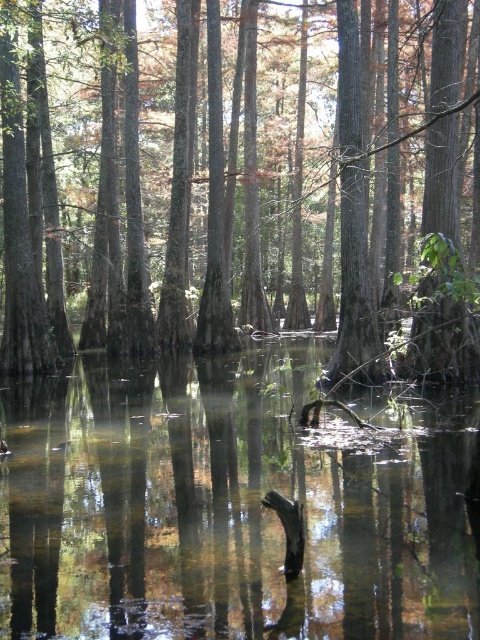
Question: Which object is farther from the camera taking this photo?

Choices:
 (A) transparent water at center
 (B) smooth brown tree trunk at center

Answer: (B)

Question: Which point is farther to the camera?

Choices:
 (A) transparent water at center
 (B) smooth brown tree trunk at center

Answer: (B)

Question: Is the position of transparent water at center more distant than that of smooth brown tree trunk at center?

Choices:
 (A) yes
 (B) no

Answer: (B)

Question: From the image, what is the correct spatial relationship of transparent water at center in relation to smooth brown tree trunk at center?

Choices:
 (A) right
 (B) left

Answer: (B)

Question: Considering the relative positions of transparent water at center and smooth brown tree trunk at center in the image provided, where is transparent water at center located with respect to smooth brown tree trunk at center?

Choices:
 (A) left
 (B) right

Answer: (A)